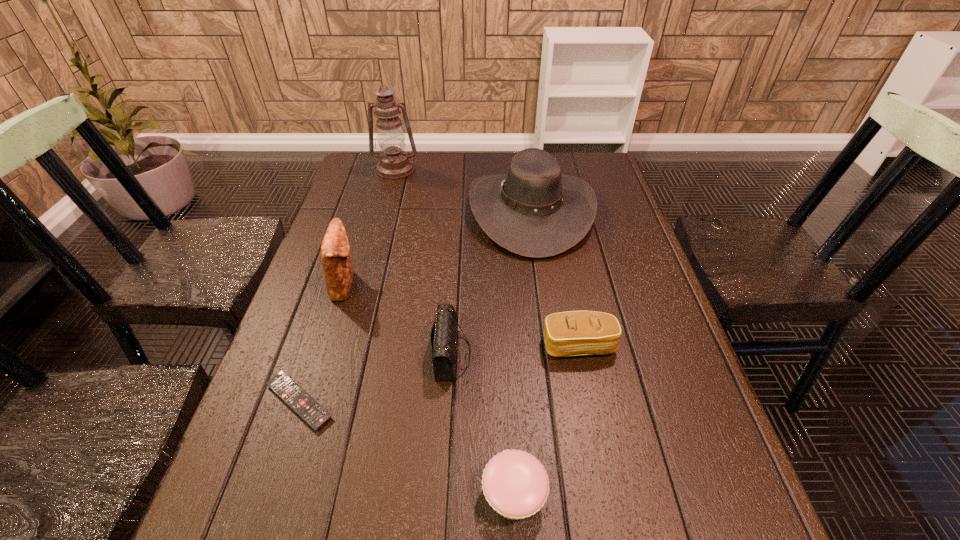
In the image, there is a desktop. What are the coordinates of `vacant space at the right edge` in the screenshot? It's located at (595, 217).

Identify the location of vacant space at the far left corner of the desktop. The width and height of the screenshot is (960, 540). pyautogui.click(x=358, y=158).

Where is `empty space that is in between the nearest object and the leftmost clutch bag`? empty space that is in between the nearest object and the leftmost clutch bag is located at coordinates (429, 389).

Where is `free point between the rightmost clutch bag and the sixth tallest object`? This screenshot has width=960, height=540. free point between the rightmost clutch bag and the sixth tallest object is located at coordinates (546, 420).

In order to click on vacant region between the tallest clutch bag and the second clutch bag from left to right in this screenshot , I will do `click(398, 319)`.

This screenshot has width=960, height=540. Identify the location of free space between the shortest object and the nearest object. (406, 448).

Identify the location of unoccupied area between the cupcake and the second clutch bag from left to right. The image size is (960, 540). (483, 425).

Find the location of a particular element. vacant space that's between the shortest object and the sixth tallest object is located at coordinates (406, 448).

You are a GUI agent. You are given a task and a screenshot of the screen. Output one action in this format:
    pyautogui.click(x=<x>, y=<y>)
    Task: Click on the unoccupied area between the third farthest object and the rightmost clutch bag
    
    Given the screenshot: What is the action you would take?
    pyautogui.click(x=462, y=315)

Identify the location of free space between the rightmost clutch bag and the second clutch bag from right to left. (516, 350).